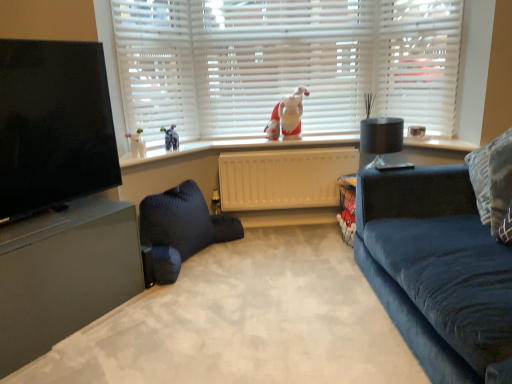
The height and width of the screenshot is (384, 512). Identify the location of vacant space in front of dark blue knitted bean bag at center. (196, 302).